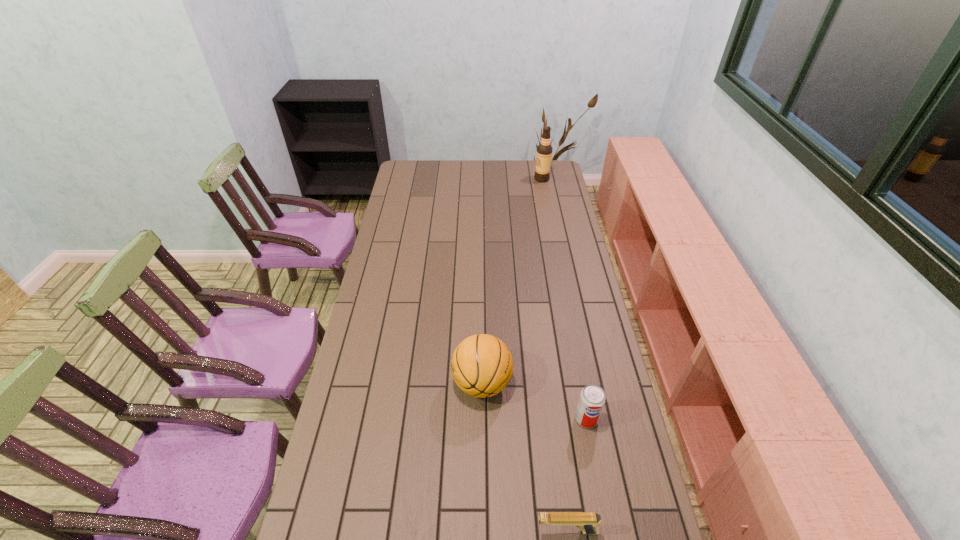
Where is `pistol situated at the right edge`? pistol situated at the right edge is located at coordinates (588, 522).

This screenshot has width=960, height=540. Identify the location of object that is positioned at the far right corner. (544, 150).

I want to click on vacant position at the far edge of the desktop, so (x=523, y=168).

Where is `vacant space at the left edge of the desktop`? Image resolution: width=960 pixels, height=540 pixels. vacant space at the left edge of the desktop is located at coordinates (396, 252).

This screenshot has width=960, height=540. In order to click on free space at the right edge in this screenshot , I will do `click(612, 396)`.

Image resolution: width=960 pixels, height=540 pixels. In order to click on free space between the soda and the alcohol in this screenshot , I will do `click(564, 299)`.

At what (x,y) coordinates should I click in order to perform the action: click on free space between the shortest object and the farthest object. Please return your answer as a coordinate pair (x, y). The height and width of the screenshot is (540, 960). Looking at the image, I should click on (554, 355).

Identify the location of free space between the second shortest object and the farthest object. point(564,299).

Find the location of a particular element. The height and width of the screenshot is (540, 960). vacant point located between the basketball and the second shortest object is located at coordinates (535, 401).

The width and height of the screenshot is (960, 540). Identify the location of free point between the shortest object and the basketball. (524, 457).